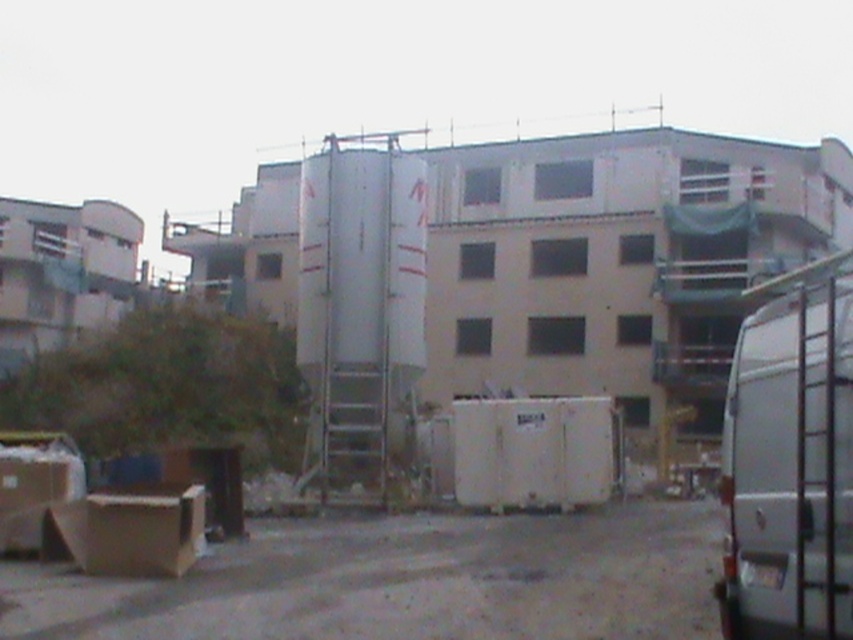
Who is positioned more to the right, brown dirt field at lower center or white matte van at right?

From the viewer's perspective, white matte van at right appears more on the right side.

Which is in front, point (143, 609) or point (741, 390)?

Positioned in front is point (741, 390).

Locate an element on the screen. The width and height of the screenshot is (853, 640). brown dirt field at lower center is located at coordinates (405, 582).

Between point (670, 596) and point (132, 502), which one is positioned behind?

The point (132, 502) is behind.

From the picture: Does brown dirt field at lower center have a lesser width compared to brown cardboard box at lower left?

In fact, brown dirt field at lower center might be wider than brown cardboard box at lower left.

Is point (41, 637) farther from camera compared to point (192, 518)?

That is False.

At what (x,y) coordinates should I click in order to perform the action: click on brown dirt field at lower center. Please return your answer as a coordinate pair (x, y). Image resolution: width=853 pixels, height=640 pixels. Looking at the image, I should click on (405, 582).

Between white matte van at right and brown cardboard box at lower left, which one has less height?

Standing shorter between the two is brown cardboard box at lower left.

Does white matte van at right have a larger size compared to brown cardboard box at lower left?

Yes.

Where is `white matte van at right`? white matte van at right is located at coordinates (788, 468).